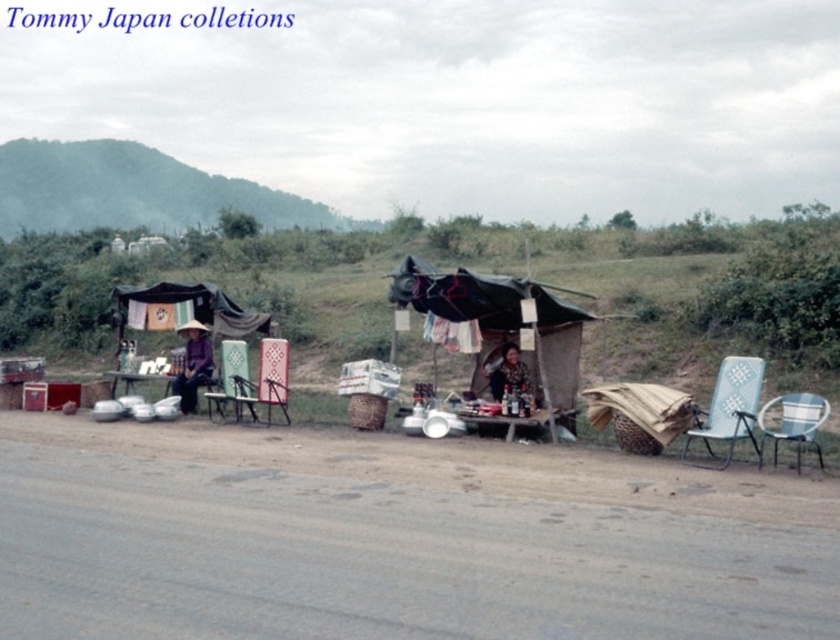
From the picture: Please provide the 2D coordinates of the light blue plastic chair at right in the image.

The light blue plastic chair at right is located at coordinates (728, 406).